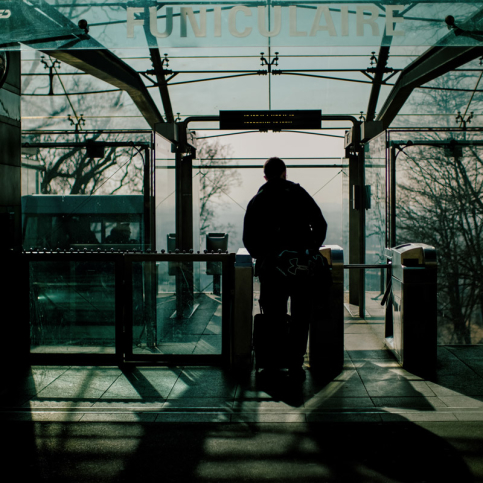
Where is `board`? board is located at coordinates (272, 116).